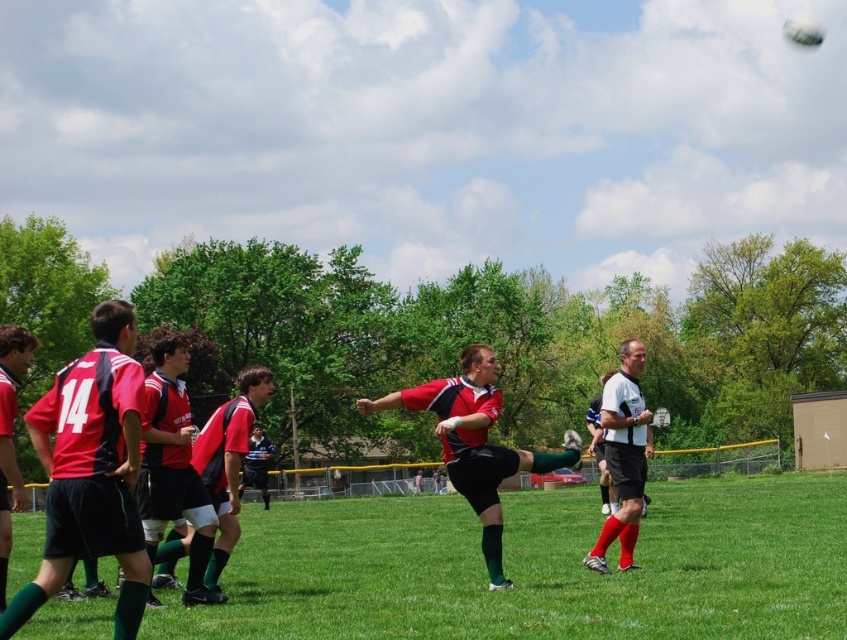
You are a soccer player trying to reach the matte red soccer ball at center. Which direction should you move from the green grass at center to get to the ball?

The green grass at center is positioned on the left side of the matte red soccer ball at center, so you should move to the right to reach the matte red soccer ball at center.